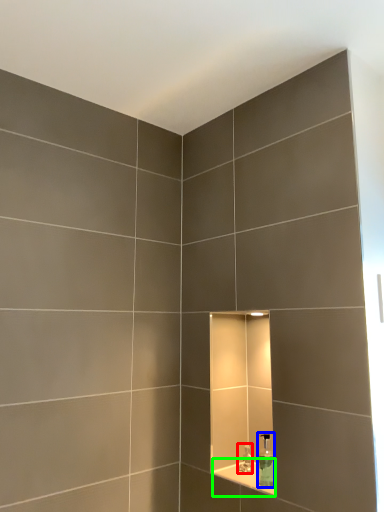
Question: Estimate the real-world distances between objects in this image. Which object is farther from faucet (highlighted by a red box), soap dispenser (highlighted by a blue box) or ledge (highlighted by a green box)?

Choices:
 (A) soap dispenser
 (B) ledge

Answer: (A)